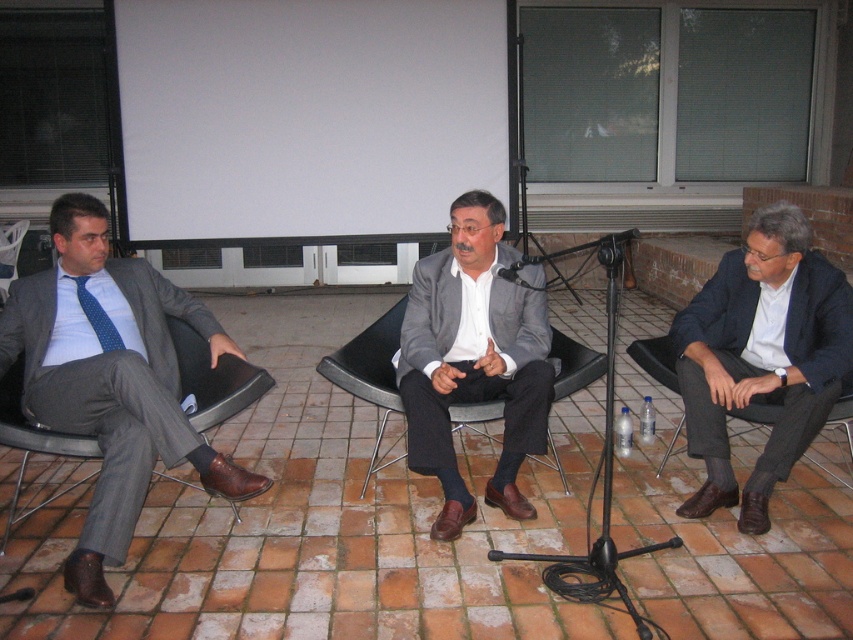
Question: Can you confirm if matte gray suit at left is thinner than blue dotted tie at left?

Choices:
 (A) no
 (B) yes

Answer: (A)

Question: Does matte gray blazer at center appear over blue dotted tie at left?

Choices:
 (A) yes
 (B) no

Answer: (B)

Question: Among these objects, which one is nearest to the camera?

Choices:
 (A) dark blue suit at center
 (B) black leather chair at left

Answer: (A)

Question: Which point is closer to the camera?

Choices:
 (A) (753, 404)
 (B) (169, 433)
 (C) (91, 294)

Answer: (B)

Question: Which point is closer to the camera taking this photo?

Choices:
 (A) (78, 278)
 (B) (498, 268)
 (C) (457, 317)
 (D) (143, 492)

Answer: (D)

Question: Considering the relative positions of black leather chair at left and black matte microphone at center in the image provided, where is black leather chair at left located with respect to black matte microphone at center?

Choices:
 (A) left
 (B) right

Answer: (A)